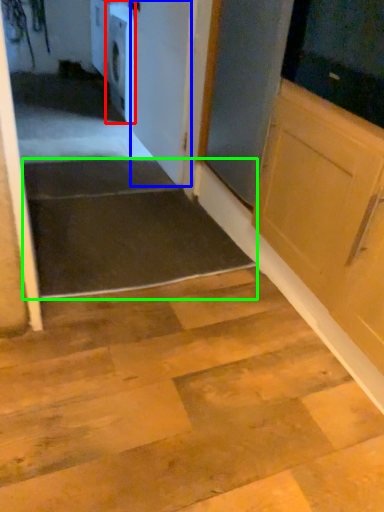
Question: Considering the real-world distances, which object is closest to dish washer (highlighted by a red box)? door (highlighted by a blue box) or stairwell (highlighted by a green box).

Choices:
 (A) door
 (B) stairwell

Answer: (A)